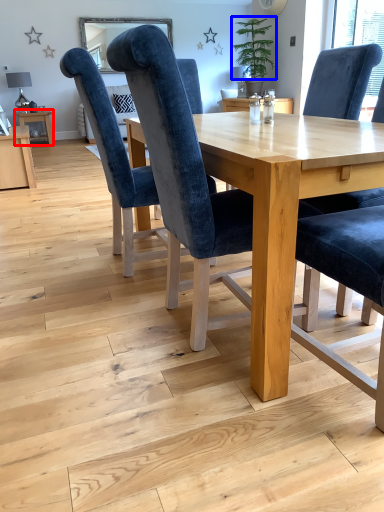
Question: Among these objects, which one is farthest to the camera, table (highlighted by a red box) or plant (highlighted by a blue box)?

Choices:
 (A) table
 (B) plant

Answer: (A)